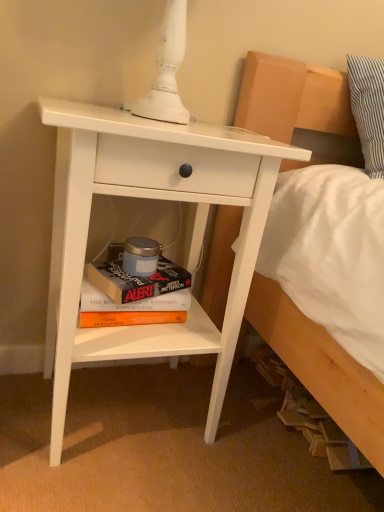
The width and height of the screenshot is (384, 512). Describe the element at coordinates (132, 302) in the screenshot. I see `hardcover book at lower center, which appears as the second paperback book when viewed from the top` at that location.

You are a GUI agent. You are given a task and a screenshot of the screen. Output one action in this format:
    pyautogui.click(x=<x>, y=<y>)
    Task: Click on the hardcover book at lower center, which appears as the second paperback book when viewed from the top
    Image resolution: width=384 pixels, height=512 pixels.
    Given the screenshot: What is the action you would take?
    pyautogui.click(x=132, y=302)

In the scene shown: From a real-world perspective, who is located higher, hardcover book at lower center, the 1th paperback book viewed from the top, or white matte nightstand at center-left?

From a 3D spatial view, white matte nightstand at center-left is above.

Which object is positioned more to the left, hardcover book at lower center, acting as the second paperback book starting from the bottom, or white matte nightstand at center-left?

From the viewer's perspective, hardcover book at lower center, acting as the second paperback book starting from the bottom, appears more on the left side.

Consider the image. Is the position of hardcover book at lower center, acting as the second paperback book starting from the bottom, more distant than that of white matte nightstand at center-left?

Yes.

Are white matte nightstand at center-left and hardcover book at lower center, the 1th paperback book viewed from the top, beside each other?

No, white matte nightstand at center-left is not touching hardcover book at lower center, the 1th paperback book viewed from the top.

Is hardcover book at lower center, the 1th paperback book viewed from the top, located within white matte nightstand at center-left?

Yes, hardcover book at lower center, the 1th paperback book viewed from the top, can be found within white matte nightstand at center-left.

Is white matte nightstand at center-left to the left of hardcover book at lower center, which is the 1th paperback book from bottom to top, from the viewer's perspective?

No, white matte nightstand at center-left is not to the left of hardcover book at lower center, which is the 1th paperback book from bottom to top.

Which is closer, (63, 307) or (84, 293)?

Point (63, 307) is positioned closer to the camera compared to point (84, 293).

Between white matte nightstand at center-left and hardcover book at lower center, which is the 1th paperback book from bottom to top, which one has more height?

Standing taller between the two is white matte nightstand at center-left.

Can you confirm if white matte nightstand at center-left is wider than hardcover book at lower center, which is the 1th paperback book from bottom to top?

Yes, white matte nightstand at center-left is wider than hardcover book at lower center, which is the 1th paperback book from bottom to top.

Is hardcover book at lower center, which is the 1th paperback book from bottom to top, positioned far away from white matte nightstand at center-left?

They are positioned close to each other.

Between point (98, 300) and point (202, 327), which one is positioned in front?

The point (98, 300) is more forward.

Where is `paperback book that is the 2nd one when counting leftward from the white matte nightstand at center-left`? paperback book that is the 2nd one when counting leftward from the white matte nightstand at center-left is located at coordinates (132, 302).

In the scene shown: Is hardcover book at lower center, acting as the second paperback book starting from the bottom, touching hardcover book at lower center, which appears as the second paperback book when viewed from the top?

Yes, hardcover book at lower center, acting as the second paperback book starting from the bottom, is beside hardcover book at lower center, which appears as the second paperback book when viewed from the top.

Between point (114, 281) and point (182, 289), which one is positioned in front?

The point (114, 281) is closer to the camera.

Is hardcover book at lower center, acting as the second paperback book starting from the bottom, looking in the opposite direction of hardcover book at lower center, which appears as the second paperback book when viewed from the top?

That's not correct — hardcover book at lower center, acting as the second paperback book starting from the bottom, is not looking away from hardcover book at lower center, which appears as the second paperback book when viewed from the top.

Is hardcover book at lower center, which is the 1th paperback book from bottom to top, aimed at hardcover book at lower center, acting as the second paperback book starting from the bottom?

No, hardcover book at lower center, which is the 1th paperback book from bottom to top, is not turned towards hardcover book at lower center, acting as the second paperback book starting from the bottom.

Considering the relative positions of hardcover book at lower center, which is the 1th paperback book from bottom to top, and hardcover book at lower center, the 1th paperback book viewed from the top, in the image provided, is hardcover book at lower center, which is the 1th paperback book from bottom to top, behind hardcover book at lower center, the 1th paperback book viewed from the top,?

Yes.

You are a GUI agent. You are given a task and a screenshot of the screen. Output one action in this format:
    pyautogui.click(x=<x>, y=<y>)
    Task: Click on the paperback book above the hardcover book at lower center, which appears as the second paperback book when viewed from the top (from the image's perspective)
    This screenshot has width=384, height=512.
    Given the screenshot: What is the action you would take?
    pyautogui.click(x=137, y=280)

Considering the positions of objects hardcover book at lower center, which is the 1th paperback book from bottom to top, and hardcover book at lower center, the 1th paperback book viewed from the top, in the image provided, who is more to the left, hardcover book at lower center, which is the 1th paperback book from bottom to top, or hardcover book at lower center, the 1th paperback book viewed from the top,?

From the viewer's perspective, hardcover book at lower center, which is the 1th paperback book from bottom to top, appears more on the left side.

There is a hardcover book at lower center, the 1th paperback book viewed from the top. Where is `nightstand above it (from a real-world perspective)`? nightstand above it (from a real-world perspective) is located at coordinates (149, 198).

Where is `nightstand on the right side of hardcover book at lower center, acting as the second paperback book starting from the bottom`? The width and height of the screenshot is (384, 512). nightstand on the right side of hardcover book at lower center, acting as the second paperback book starting from the bottom is located at coordinates (149, 198).

Looking at the image, which one is located closer to hardcover book at lower center, which is the 1th paperback book from bottom to top, white matte nightstand at center-left or hardcover book at lower center, the 1th paperback book viewed from the top?

hardcover book at lower center, the 1th paperback book viewed from the top, is closer to hardcover book at lower center, which is the 1th paperback book from bottom to top.

Estimate the real-world distances between objects in this image. Which object is further from hardcover book at lower center, which appears as the second paperback book when viewed from the top, hardcover book at lower center, acting as the second paperback book starting from the bottom, or white matte nightstand at center-left?

white matte nightstand at center-left is further to hardcover book at lower center, which appears as the second paperback book when viewed from the top.

Considering their positions, is hardcover book at lower center, which is the 1th paperback book from bottom to top, positioned closer to white matte nightstand at center-left than hardcover book at lower center, the 1th paperback book viewed from the top?

hardcover book at lower center, the 1th paperback book viewed from the top, is closer to white matte nightstand at center-left.

Based on their spatial positions, is hardcover book at lower center, which is the 1th paperback book from bottom to top, or white matte nightstand at center-left closer to hardcover book at lower center, acting as the second paperback book starting from the bottom?

The object closer to hardcover book at lower center, acting as the second paperback book starting from the bottom, is hardcover book at lower center, which is the 1th paperback book from bottom to top.

Estimate the real-world distances between objects in this image. Which object is closer to hardcover book at lower center, the 1th paperback book viewed from the top, white matte nightstand at center-left or hardcover book at lower center, which appears as the second paperback book when viewed from the top?

The object closer to hardcover book at lower center, the 1th paperback book viewed from the top, is hardcover book at lower center, which appears as the second paperback book when viewed from the top.

Looking at the image, which one is located closer to white matte nightstand at center-left, hardcover book at lower center, acting as the second paperback book starting from the bottom, or hardcover book at lower center, which is the 1th paperback book from bottom to top?

hardcover book at lower center, acting as the second paperback book starting from the bottom, is positioned closer to the anchor white matte nightstand at center-left.

Find the location of a particular element. paperback book between white matte nightstand at center-left and hardcover book at lower center, which appears as the second paperback book when viewed from the top, along the z-axis is located at coordinates (137, 280).